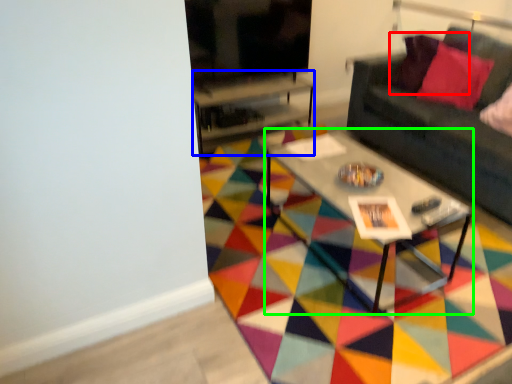
Question: Which object is positioned closest to pillow (highlighted by a red box)? Select from table (highlighted by a blue box) and coffee table (highlighted by a green box).

Choices:
 (A) table
 (B) coffee table

Answer: (A)